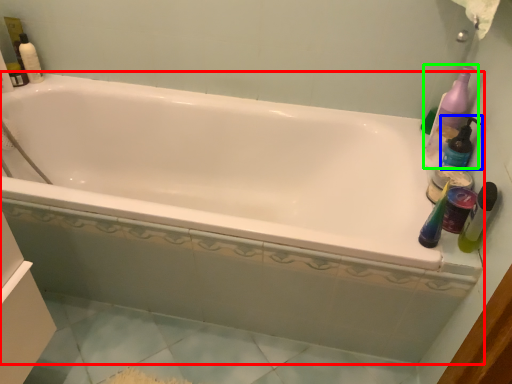
Question: Based on their relative distances, which object is farther from bathtub (highlighted by a red box)? Choose from cleaning product (highlighted by a blue box) and cleaning product (highlighted by a green box).

Choices:
 (A) cleaning product
 (B) cleaning product

Answer: (A)